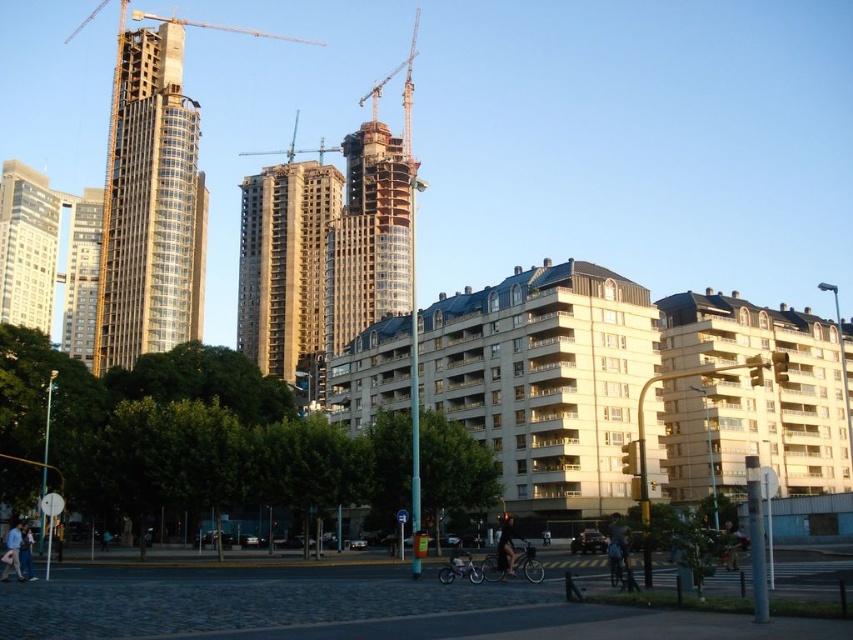
Based on the scene description, where is the matte glass skyscraper at upper left located in terms of its coordinates?

The matte glass skyscraper at upper left is located at coordinates point (27, 246).

You are a delivery person trying to navigate through the urban area shown. You need to deliver a package to the address located at the base of the matte glass skyscraper at upper left. You see the black matte bicycle at center blocking your path. Which direction should you move to avoid the bicycle and reach your destination?

The matte glass skyscraper at upper left is positioned on the left side of the black matte bicycle at center. To avoid the bicycle and reach the skyscraper, move to the left side of the bicycle.

Consider the image. You are a construction worker standing at the point labeled point (402, 90) in the urban scene. You need to move to the nearest construction crane. Is the metallic construction crane at upper center the closest one to your current position?

Yes, the point (402, 90) indicates the metallic construction crane at upper center, so you are already at the location of the crane.